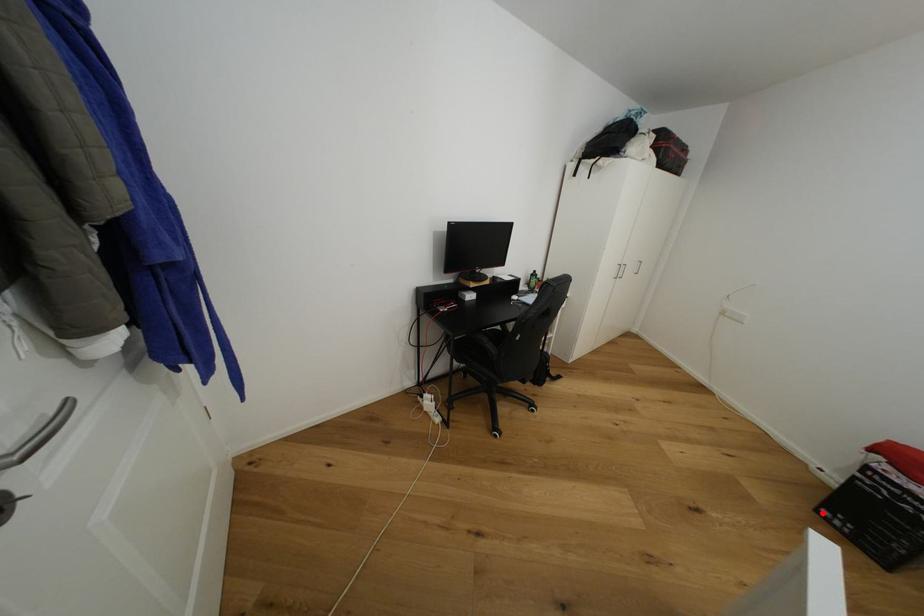
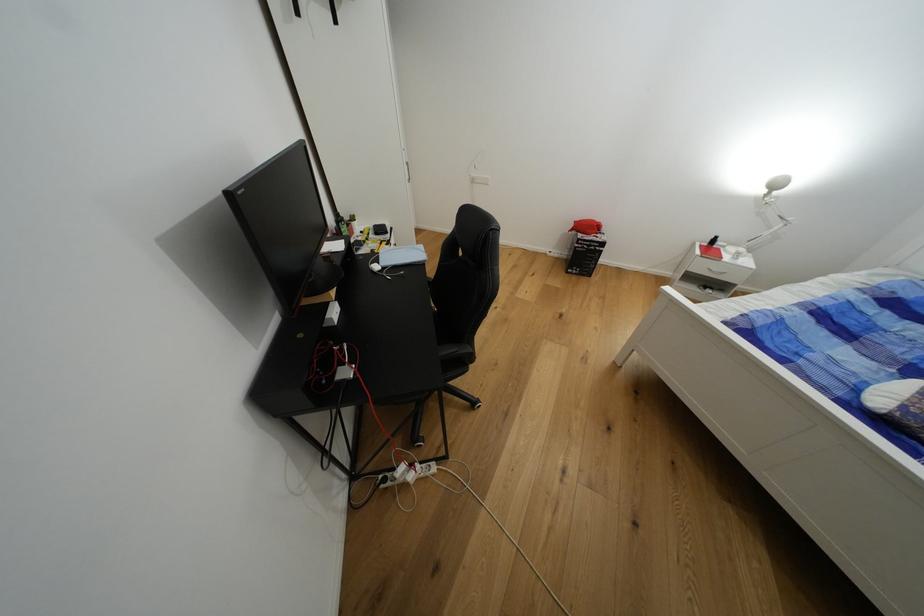
In the second image, find the point that corresponds to the highlighted location in the first image.

(573, 274)